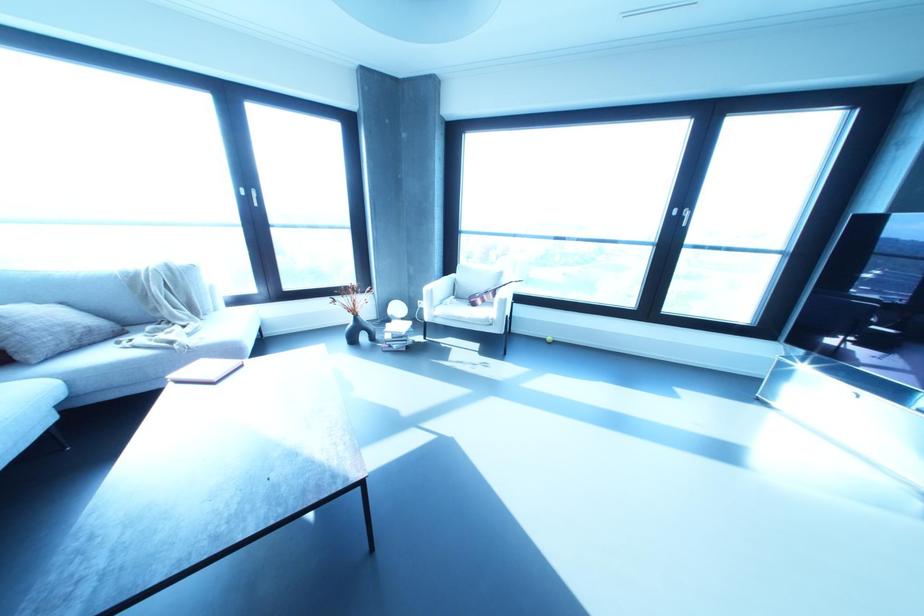
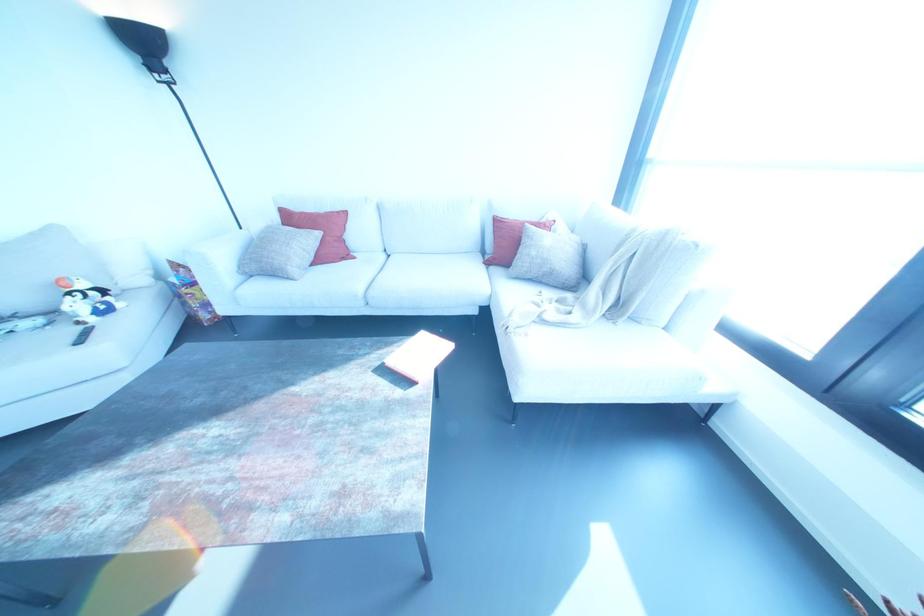
The point at (90,330) is marked in the first image. Where is the corresponding point in the second image?

(551, 273)